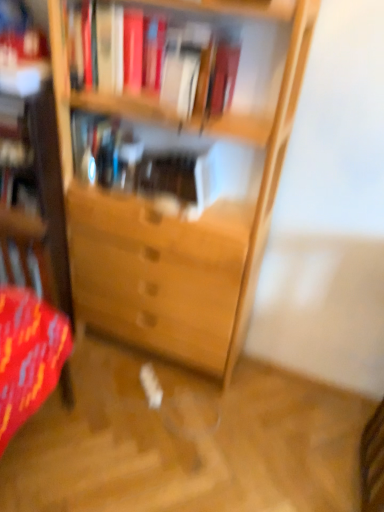
Question: In terms of height, does translucent glass vase at center, placed as the first book when sorted from back to front, look taller or shorter compared to hardcover books at upper center, the second book viewed from the back?

Choices:
 (A) short
 (B) tall

Answer: (A)

Question: Is translucent glass vase at center, placed as the first book when sorted from back to front, inside or outside of hardcover books at upper center, which is the first book in front-to-back order?

Choices:
 (A) outside
 (B) inside

Answer: (A)

Question: From a real-world perspective, is translucent glass vase at center, which is counted as the second book, starting from the front, physically located above or below hardcover books at upper center, the second book viewed from the back?

Choices:
 (A) below
 (B) above

Answer: (A)

Question: From the image's perspective, is hardcover books at upper center, the second book viewed from the back, above or below translucent glass vase at center, which is counted as the second book, starting from the front?

Choices:
 (A) below
 (B) above

Answer: (B)

Question: Is point (235, 52) positioned closer to the camera than point (99, 170)?

Choices:
 (A) closer
 (B) farther

Answer: (A)

Question: Looking at the image, does hardcover books at upper center, the second book viewed from the back, seem bigger or smaller compared to translucent glass vase at center, which is counted as the second book, starting from the front?

Choices:
 (A) small
 (B) big

Answer: (B)

Question: Considering the positions of hardcover books at upper center, the second book viewed from the back, and translucent glass vase at center, placed as the first book when sorted from back to front, in the image, is hardcover books at upper center, the second book viewed from the back, taller or shorter than translucent glass vase at center, placed as the first book when sorted from back to front,?

Choices:
 (A) tall
 (B) short

Answer: (A)